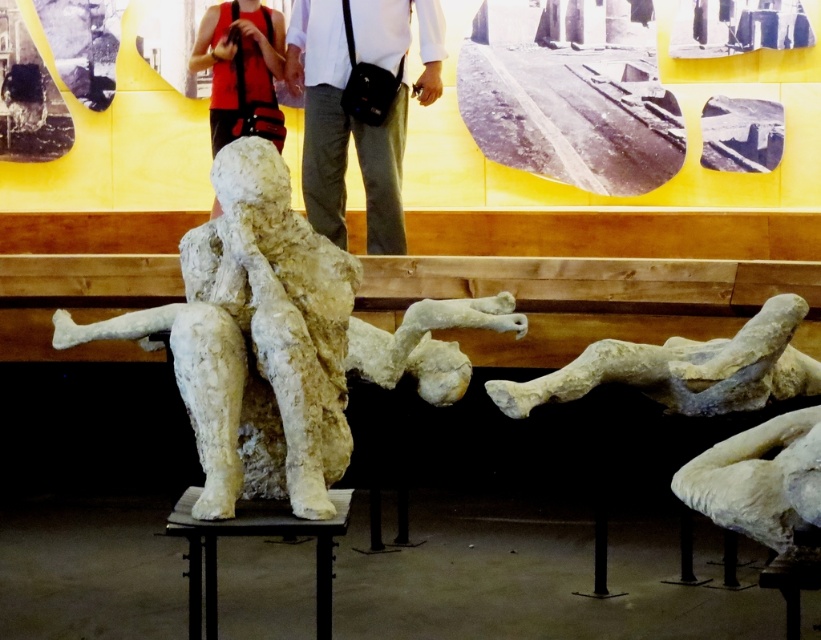
You are an art curator standing at the entrance of the exhibition space. You need to place a new sculpture exactly at the center of the room. The current white stone figure at center is already placed at coordinates 0.533, 0.334. Is this placement correct for the center?

The white stone figure at center is already placed at the coordinates [273,340], which corresponds to the center of the room. Therefore, the placement is correct.